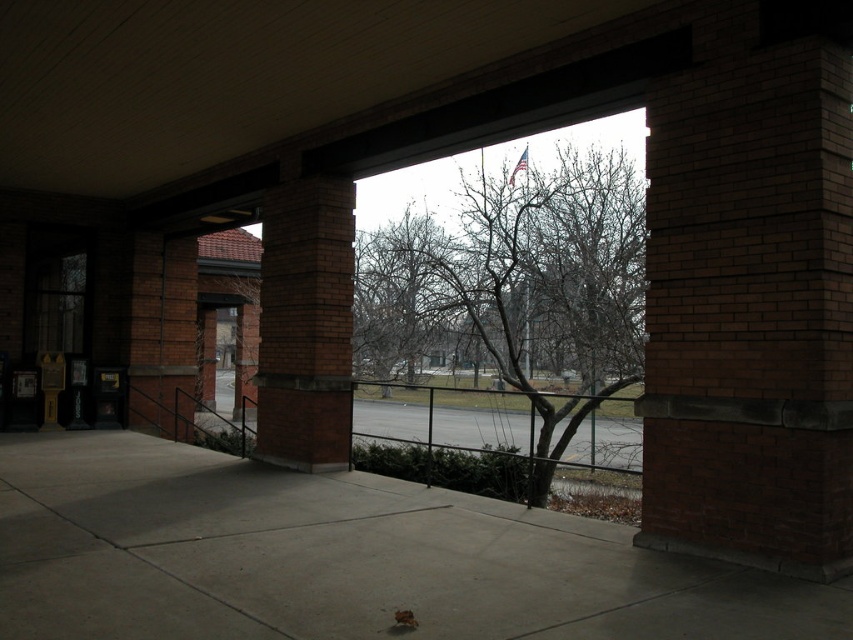
Does concrete at center appear under brown brick column at center?

Indeed, concrete at center is positioned under brown brick column at center.

This screenshot has height=640, width=853. Describe the element at coordinates (340, 557) in the screenshot. I see `concrete at center` at that location.

Who is more forward, (756, 579) or (274, 426)?

Positioned in front is point (756, 579).

Where is `concrete at center`? Image resolution: width=853 pixels, height=640 pixels. concrete at center is located at coordinates (340, 557).

Is concrete at center to the left of bare branches at center from the viewer's perspective?

Correct, you'll find concrete at center to the left of bare branches at center.

Locate an element on the screen. The width and height of the screenshot is (853, 640). concrete at center is located at coordinates (340, 557).

At what (x,y) coordinates should I click in order to perform the action: click on concrete at center. Please return your answer as a coordinate pair (x, y). Looking at the image, I should click on (340, 557).

Who is taller, bare branches at center or brown brick column at center?

brown brick column at center is taller.

Who is more forward, (631, 188) or (283, 284)?

Positioned in front is point (283, 284).

Locate an element on the screen. This screenshot has width=853, height=640. bare branches at center is located at coordinates (515, 289).